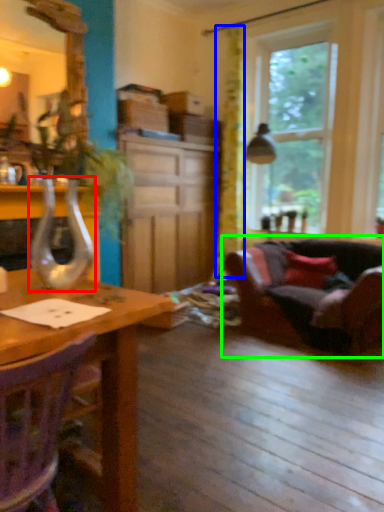
Question: Which is nearer to the glass vase (highlighted by a red box)? curtain (highlighted by a blue box) or studio couch (highlighted by a green box).

Choices:
 (A) curtain
 (B) studio couch

Answer: (B)